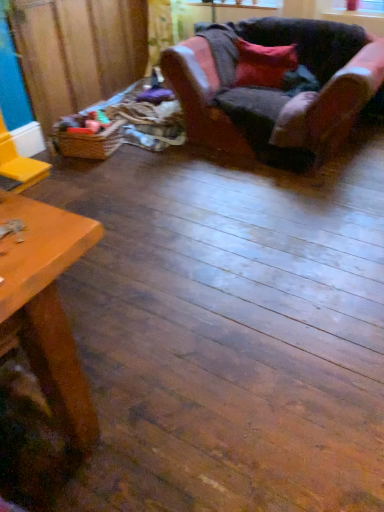
Question: From a real-world perspective, is transparent plastic window screen at upper center on top of velvet-like pink armchair at upper right?

Choices:
 (A) no
 (B) yes

Answer: (B)

Question: Would you say transparent plastic window screen at upper center is a long distance from velvet-like pink armchair at upper right?

Choices:
 (A) no
 (B) yes

Answer: (A)

Question: Considering the relative sizes of transparent plastic window screen at upper center and velvet-like pink armchair at upper right in the image provided, is transparent plastic window screen at upper center shorter than velvet-like pink armchair at upper right?

Choices:
 (A) yes
 (B) no

Answer: (A)

Question: Is velvet-like pink armchair at upper right at the back of transparent plastic window screen at upper center?

Choices:
 (A) yes
 (B) no

Answer: (B)

Question: Is transparent plastic window screen at upper center wider than velvet-like pink armchair at upper right?

Choices:
 (A) yes
 (B) no

Answer: (B)

Question: From the image's perspective, is transparent plastic window screen at upper center located above velvet-like pink armchair at upper right?

Choices:
 (A) no
 (B) yes

Answer: (B)

Question: Are velvet-like pink armchair at upper right and brown woven basket at left far apart?

Choices:
 (A) yes
 (B) no

Answer: (A)

Question: Is velvet-like pink armchair at upper right bigger than brown woven basket at left?

Choices:
 (A) no
 (B) yes

Answer: (B)

Question: Is velvet-like pink armchair at upper right facing away from brown woven basket at left?

Choices:
 (A) yes
 (B) no

Answer: (B)

Question: Is velvet-like pink armchair at upper right positioned in front of brown woven basket at left?

Choices:
 (A) no
 (B) yes

Answer: (B)

Question: Does velvet-like pink armchair at upper right have a lesser height compared to brown woven basket at left?

Choices:
 (A) no
 (B) yes

Answer: (B)

Question: Is velvet-like pink armchair at upper right at the right side of brown woven basket at left?

Choices:
 (A) yes
 (B) no

Answer: (A)

Question: From the image's perspective, would you say woven brown basket at left is shown under transparent plastic window screen at upper center?

Choices:
 (A) yes
 (B) no

Answer: (A)